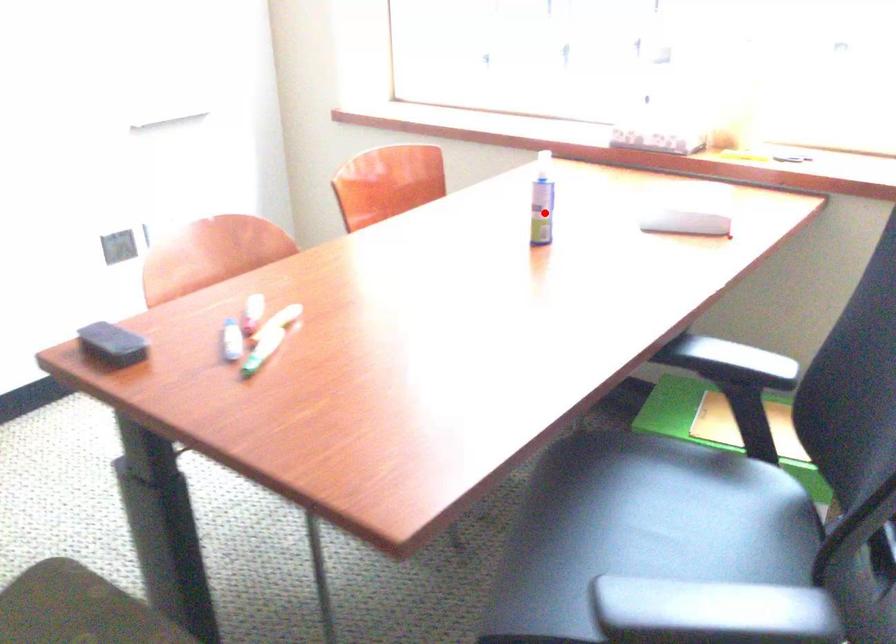
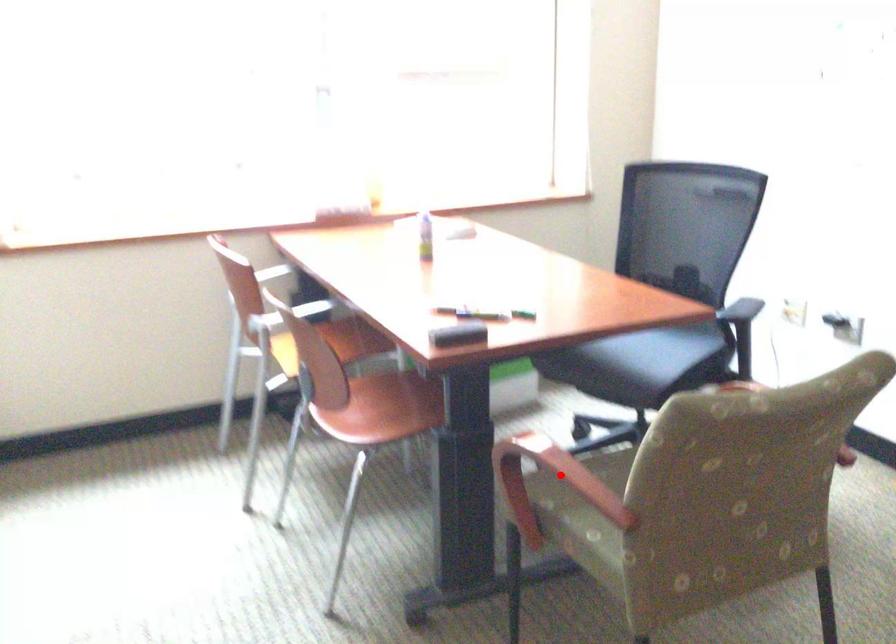
I am providing you with two images of the same scene from different viewpoints. A red point is marked on the first image and another point is marked on the second image. Does the point marked in image1 correspond to the same location as the one in image2?

No